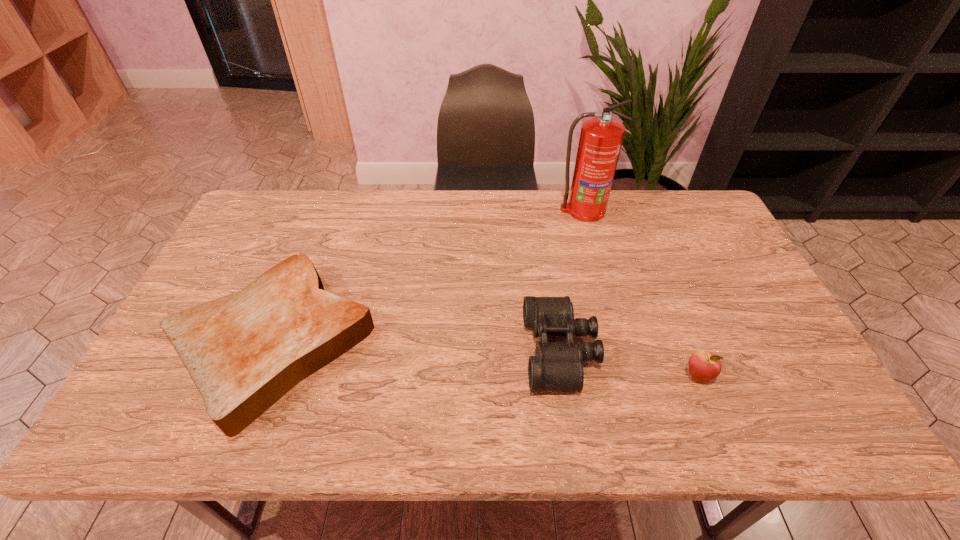
The image size is (960, 540). What are the coordinates of `vacant space situated 0.200m on the back of the rightmost object` in the screenshot? It's located at (668, 302).

Identify the location of vacant area situated 0.360m on the back of the bread. The width and height of the screenshot is (960, 540). (329, 200).

Identify the location of object that is at the far edge. This screenshot has height=540, width=960. (601, 137).

Image resolution: width=960 pixels, height=540 pixels. Identify the location of object at the near edge. (244, 351).

You are a GUI agent. You are given a task and a screenshot of the screen. Output one action in this format:
    pyautogui.click(x=<x>, y=<y>)
    Task: Click on the object at the left edge
    
    Given the screenshot: What is the action you would take?
    pyautogui.click(x=244, y=351)

This screenshot has width=960, height=540. Identify the location of object that is at the near left corner. (244, 351).

Locate an element on the screen. vacant space at the far edge is located at coordinates (447, 231).

In the image, there is a desktop. Where is `vacant space at the near edge`? The image size is (960, 540). vacant space at the near edge is located at coordinates (487, 428).

Identify the location of free space at the left edge. (155, 374).

The height and width of the screenshot is (540, 960). In the image, there is a desktop. In order to click on vacant space at the right edge in this screenshot , I will do `click(743, 343)`.